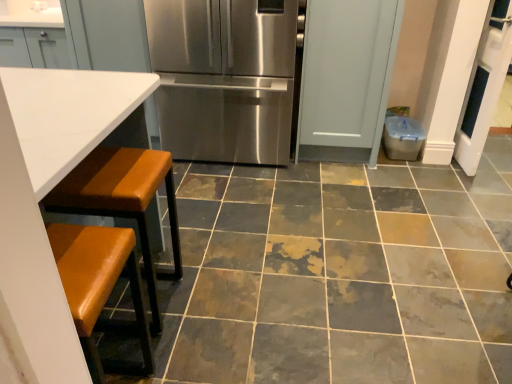
Find the location of a particular element. The width and height of the screenshot is (512, 384). free point above marble-like ceramic tile at center (from a real-world perspective) is located at coordinates (329, 226).